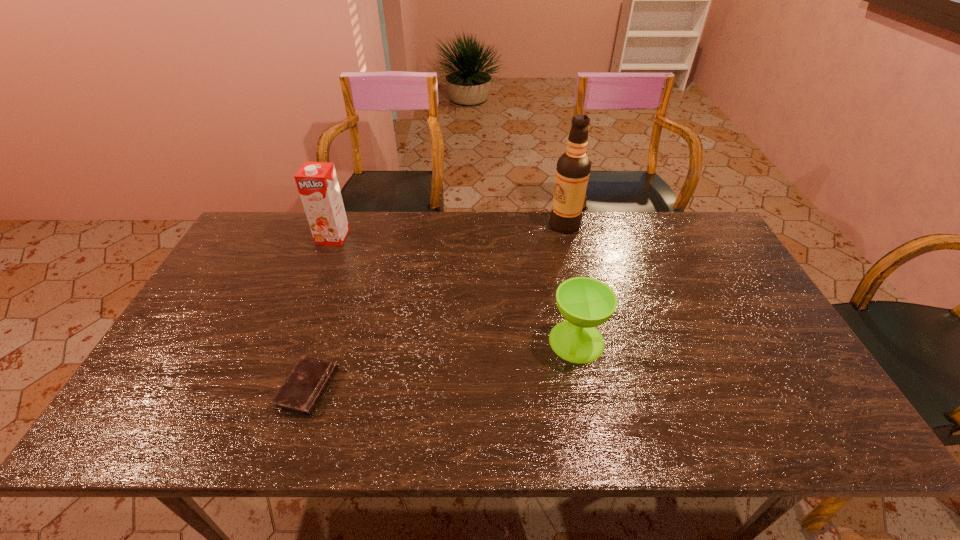
What are the coordinates of `blank region between the second tallest object and the wineglass` in the screenshot? It's located at (455, 289).

Locate an element on the screen. Image resolution: width=960 pixels, height=540 pixels. free space between the second tallest object and the shortest object is located at coordinates (321, 313).

I want to click on vacant space in between the second shortest object and the carton, so click(x=455, y=289).

This screenshot has width=960, height=540. I want to click on free spot between the shortest object and the carton, so click(x=321, y=313).

At what (x,y) coordinates should I click in order to perform the action: click on blank region between the second tallest object and the wineglass. Please return your answer as a coordinate pair (x, y). Image resolution: width=960 pixels, height=540 pixels. Looking at the image, I should click on (455, 289).

Locate an element on the screen. free space between the second shortest object and the carton is located at coordinates (455, 289).

This screenshot has height=540, width=960. Identify the location of empty location between the shortest object and the third shortest object. click(x=321, y=313).

Locate which object is the closest to the shortest object. Please provide its 2D coordinates. Your answer should be formatted as a tuple, i.e. [(x, y)], where the tuple contains the x and y coordinates of a point satisfying the conditions above.

[(317, 183)]

I want to click on object that is the second closest one to the shortest object, so click(x=585, y=303).

Find the location of a particular element. This screenshot has height=540, width=960. free point that satisfies the following two spatial constraints: 1. on the front side of the wineglass; 2. on the left side of the second tallest object is located at coordinates (292, 341).